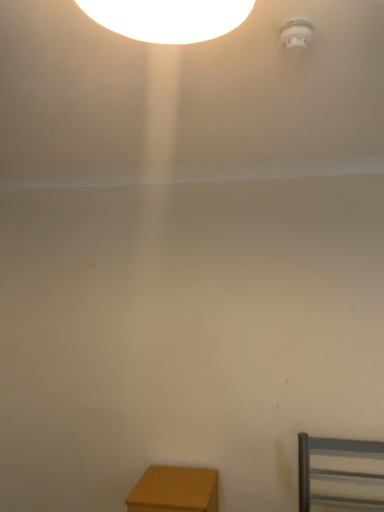
Question: Does matte wood table at lower left have a lesser width compared to white plastic smoke detector at upper right?

Choices:
 (A) yes
 (B) no

Answer: (B)

Question: Is matte wood table at lower left closer to camera compared to white plastic smoke detector at upper right?

Choices:
 (A) no
 (B) yes

Answer: (A)

Question: Can you confirm if matte wood table at lower left is smaller than white plastic smoke detector at upper right?

Choices:
 (A) yes
 (B) no

Answer: (B)

Question: Would you say matte wood table at lower left contains white plastic smoke detector at upper right?

Choices:
 (A) yes
 (B) no

Answer: (B)

Question: Are matte wood table at lower left and white plastic smoke detector at upper right making contact?

Choices:
 (A) no
 (B) yes

Answer: (A)

Question: Is matte wood table at lower left to the right of white plastic smoke detector at upper right from the viewer's perspective?

Choices:
 (A) yes
 (B) no

Answer: (B)

Question: From the image's perspective, is white plastic smoke detector at upper right above matte wood table at lower left?

Choices:
 (A) no
 (B) yes

Answer: (B)

Question: Is white plastic smoke detector at upper right at the right side of matte wood table at lower left?

Choices:
 (A) yes
 (B) no

Answer: (A)

Question: Is white plastic smoke detector at upper right next to matte wood table at lower left and touching it?

Choices:
 (A) no
 (B) yes

Answer: (A)

Question: From the image's perspective, would you say white plastic smoke detector at upper right is shown under matte wood table at lower left?

Choices:
 (A) no
 (B) yes

Answer: (A)

Question: Can you confirm if white plastic smoke detector at upper right is wider than matte wood table at lower left?

Choices:
 (A) no
 (B) yes

Answer: (A)

Question: Is white plastic smoke detector at upper right not within matte wood table at lower left?

Choices:
 (A) yes
 (B) no

Answer: (A)

Question: From the image's perspective, is matte wood table at lower left positioned above or below white plastic smoke detector at upper right?

Choices:
 (A) below
 (B) above

Answer: (A)